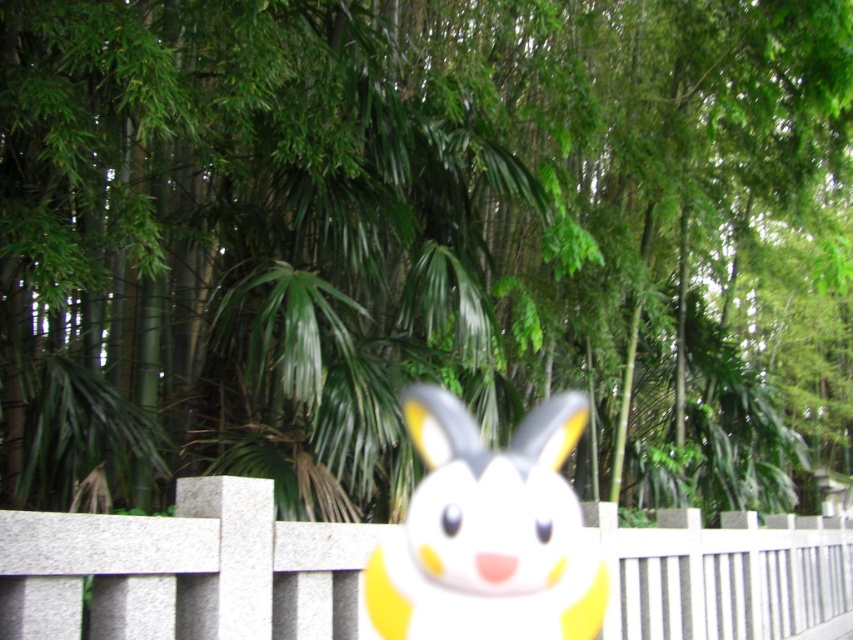
Who is positioned more to the right, white stone fence at center or yellow matte bunny at center?

yellow matte bunny at center

Is white stone fence at center further to the viewer compared to yellow matte bunny at center?

No, white stone fence at center is closer to the viewer.

Where is `white stone fence at center`? This screenshot has width=853, height=640. white stone fence at center is located at coordinates (184, 570).